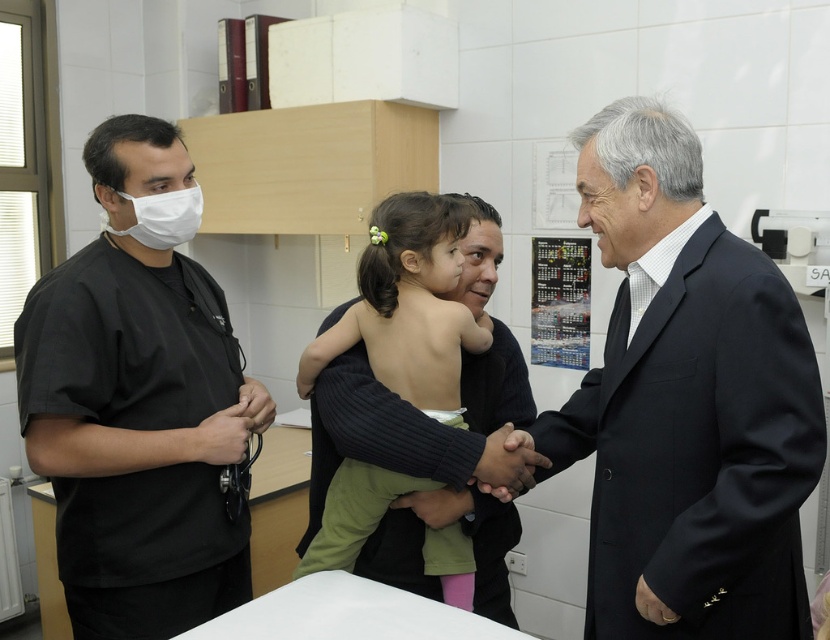
You are a visitor entering the clinic and need to locate the black suit coat at center and the skinny green dress at center. According to the scene, which one is positioned to the right of the other?

The black suit coat at center is to the right of the skinny green dress at center.

You are a visitor entering the clinic and need to locate the nurse station. You see the black scrubs at left and the metallic keychain at lower left. Based on their positions, which direction should you move to reach the nurse station?

Since the black scrubs at left is to the left of the metallic keychain at lower left, the nurse station is likely located to the right of the metallic keychain at lower left. Move towards the right side of the metallic keychain at lower left to find the nurse station.